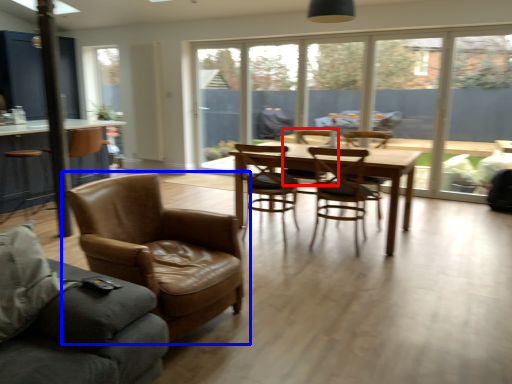
Question: Which of the following is the closest to the observer, chair (highlighted by a red box) or chair (highlighted by a blue box)?

Choices:
 (A) chair
 (B) chair

Answer: (B)